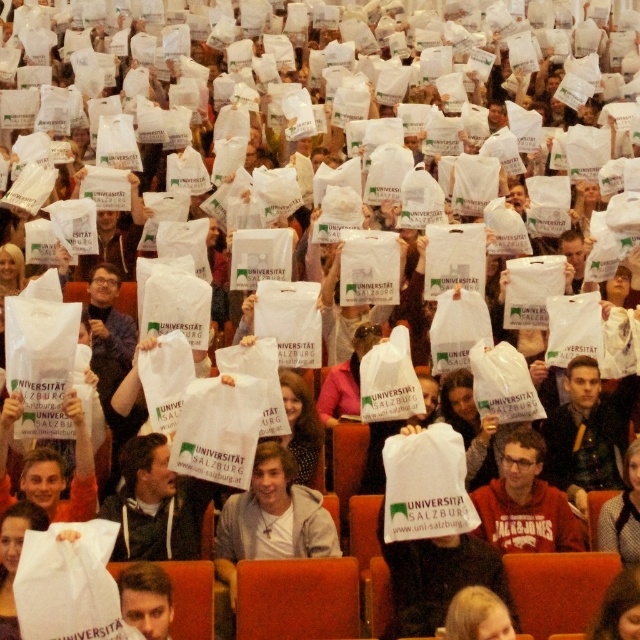
Question: Considering the real-world distances, which object is closest to the white cotton shirt at center?

Choices:
 (A) matte white bag at center
 (B) smooth white shirt at lower left

Answer: (B)

Question: Which of the following is the farthest from the observer?

Choices:
 (A) white cotton shirt at center
 (B) smooth white shirt at lower left
 (C) blonde hair at center

Answer: (A)

Question: Is white cotton shirt at center thinner than smooth white shirt at lower left?

Choices:
 (A) no
 (B) yes

Answer: (A)

Question: Is white cotton shirt at center positioned in front of smooth white shirt at lower left?

Choices:
 (A) yes
 (B) no

Answer: (B)

Question: Which point is closer to the camera taking this photo?

Choices:
 (A) tap(497, 524)
 (B) tap(474, 611)
 (C) tap(145, 600)
 (D) tap(260, 452)

Answer: (B)

Question: Is white cotton shirt at center above smooth white shirt at lower left?

Choices:
 (A) no
 (B) yes

Answer: (B)